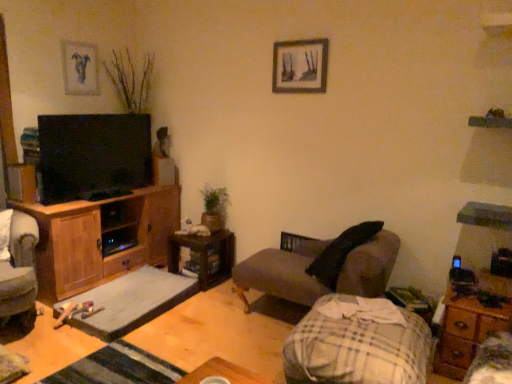
What do you see at coordinates (214, 207) in the screenshot?
I see `green matte plant at center` at bounding box center [214, 207].

The image size is (512, 384). What do you see at coordinates (470, 324) in the screenshot?
I see `wooden nightstand at lower right` at bounding box center [470, 324].

The width and height of the screenshot is (512, 384). Describe the element at coordinates (80, 68) in the screenshot. I see `matte blue painting at upper left, the first picture frame when ordered from back to front` at that location.

What is the approximate width of matte blue painting at upper left, which appears as the 2th picture frame when viewed from the front?

matte blue painting at upper left, which appears as the 2th picture frame when viewed from the front, is 1.08 inches in width.

What do you see at coordinates (204, 255) in the screenshot? I see `brown wooden side table at center` at bounding box center [204, 255].

The height and width of the screenshot is (384, 512). Find the location of `brown wooden side table at center`. brown wooden side table at center is located at coordinates (x=204, y=255).

The image size is (512, 384). I want to click on dark gray fabric couch at center, so 314,277.

Where is `wooden cabinet at left`? The height and width of the screenshot is (384, 512). wooden cabinet at left is located at coordinates (101, 238).

Considering the relative sizes of wooden cabinet at left and brown wooden side table at center in the image provided, is wooden cabinet at left bigger than brown wooden side table at center?

Yes.

Considering the relative positions of wooden cabinet at left and brown wooden side table at center in the image provided, is wooden cabinet at left in front of brown wooden side table at center?

Yes, wooden cabinet at left is closer to the viewer.

From a real-world perspective, is wooden cabinet at left above or below brown wooden side table at center?

From a real-world perspective, wooden cabinet at left is physically above brown wooden side table at center.

From the image's perspective, between gray fabric armchair at left and matte blue painting at upper left, the first picture frame when ordered from back to front, which one is located above?

From the image's view, matte blue painting at upper left, the first picture frame when ordered from back to front, is above.

Considering the sizes of objects gray fabric armchair at left and matte blue painting at upper left, the second picture frame viewed from the right, in the image provided, who is smaller, gray fabric armchair at left or matte blue painting at upper left, the second picture frame viewed from the right,?

matte blue painting at upper left, the second picture frame viewed from the right.

Between gray fabric armchair at left and matte blue painting at upper left, which appears as the 2th picture frame when viewed from the front, which one is positioned behind?

matte blue painting at upper left, which appears as the 2th picture frame when viewed from the front, is behind.

Is point (11, 243) positioned behind point (78, 76)?

No, it is in front of (78, 76).

Is wooden nightstand at lower right at the left side of plaid fabric blanket at lower right?

Incorrect, wooden nightstand at lower right is not on the left side of plaid fabric blanket at lower right.

This screenshot has height=384, width=512. There is a plaid fabric blanket at lower right. What are the coordinates of `nightstand above it (from a real-world perspective)` in the screenshot? It's located at [x=470, y=324].

From the image's perspective, which one is positioned higher, wooden nightstand at lower right or plaid fabric blanket at lower right?

wooden nightstand at lower right is shown above in the image.

Considering their positions, is wooden nightstand at lower right located in front of or behind plaid fabric blanket at lower right?

In the image, wooden nightstand at lower right appears behind plaid fabric blanket at lower right.

Considering the sizes of objects wooden nightstand at lower right and green matte plant at center in the image provided, who is shorter, wooden nightstand at lower right or green matte plant at center?

With less height is wooden nightstand at lower right.

Does wooden nightstand at lower right turn towards green matte plant at center?

No.

Between wooden nightstand at lower right and green matte plant at center, which one appears on the left side from the viewer's perspective?

Positioned to the left is green matte plant at center.

Considering the relative positions of green matte plant at center and gray fabric armchair at left in the image provided, is green matte plant at center to the left of gray fabric armchair at left from the viewer's perspective?

No, green matte plant at center is not to the left of gray fabric armchair at left.

Relative to gray fabric armchair at left, is green matte plant at center in front or behind?

Clearly, green matte plant at center is behind gray fabric armchair at left.

From the image's perspective, which one is positioned higher, green matte plant at center or gray fabric armchair at left?

From the image's view, green matte plant at center is above.

Is plaid fabric blanket at lower right at the left side of wooden cabinet at left?

Incorrect, plaid fabric blanket at lower right is not on the left side of wooden cabinet at left.

Does point (321, 325) lie in front of point (38, 226)?

Yes, it is in front of point (38, 226).

Considering the sizes of objects plaid fabric blanket at lower right and wooden cabinet at left in the image provided, who is taller, plaid fabric blanket at lower right or wooden cabinet at left?

Standing taller between the two is wooden cabinet at left.

From the image's perspective, between plaid fabric blanket at lower right and wooden cabinet at left, which one is located above?

wooden cabinet at left appears higher in the image.

Is brown wooden side table at center not within gray fabric footrest at lower center?

That's correct, brown wooden side table at center is outside of gray fabric footrest at lower center.

Looking at their sizes, would you say brown wooden side table at center is wider or thinner than gray fabric footrest at lower center?

Considering their sizes, brown wooden side table at center looks slimmer than gray fabric footrest at lower center.

From a real-world perspective, is brown wooden side table at center physically below gray fabric footrest at lower center?

No, from a real-world perspective, brown wooden side table at center is not beneath gray fabric footrest at lower center.

Is brown wooden side table at center to the left of gray fabric footrest at lower center from the viewer's perspective?

No, brown wooden side table at center is not to the left of gray fabric footrest at lower center.

In the image, there is a brown wooden side table at center. Where is `cabinetry above it (from the image's perspective)`? This screenshot has width=512, height=384. cabinetry above it (from the image's perspective) is located at coordinates (101, 238).

From a real-world perspective, count 1st picture frames upward from the gray fabric armchair at left and point to it. Please provide its 2D coordinates.

[(80, 68)]

From the image, which object appears to be nearer to gray fabric armchair at left, green matte plant at center or wooden nightstand at lower right?

Among the two, green matte plant at center is located nearer to gray fabric armchair at left.

When comparing their distances from wooden nightstand at lower right, does plaid fabric blanket at lower right or brown wooden side table at center seem further?

Among the two, brown wooden side table at center is located further to wooden nightstand at lower right.

Looking at the image, which one is located closer to dark gray fabric couch at center, green matte plant at center or wooden picture frame at upper center, the second picture frame in the left-to-right sequence?

green matte plant at center is positioned closer to the anchor dark gray fabric couch at center.

Considering their positions, is wooden cabinet at left positioned closer to brown wooden side table at center than gray fabric armchair at left?

Based on the image, wooden cabinet at left appears to be nearer to brown wooden side table at center.

Which object lies nearer to the anchor point gray fabric footrest at lower center, dark gray fabric couch at center or plaid fabric blanket at lower right?

The object closer to gray fabric footrest at lower center is dark gray fabric couch at center.

Looking at the image, which one is located closer to plaid fabric blanket at lower right, matte blue painting at upper left, which appears as the 2th picture frame when viewed from the front, or wooden cabinet at left?

wooden cabinet at left is positioned closer to the anchor plaid fabric blanket at lower right.

Which object lies nearer to the anchor point wooden nightstand at lower right, matte blue painting at upper left, the second picture frame viewed from the right, or brown wooden side table at center?

brown wooden side table at center is positioned closer to the anchor wooden nightstand at lower right.

Estimate the real-world distances between objects in this image. Which object is closer to green matte plant at center, gray fabric footrest at lower center or wooden nightstand at lower right?

gray fabric footrest at lower center lies closer to green matte plant at center than the other object.

The image size is (512, 384). I want to click on side table between wooden picture frame at upper center, the second picture frame in the left-to-right sequence, and dark gray fabric couch at center in the up-down direction, so [x=204, y=255].

Identify the location of picture frame between wooden cabinet at left and dark gray fabric couch at center. The width and height of the screenshot is (512, 384). (300, 66).

Where is `footrest between matte blue painting at upper left, which is the first picture frame from left to right, and wooden nightstand at lower right from left to right`? The image size is (512, 384). footrest between matte blue painting at upper left, which is the first picture frame from left to right, and wooden nightstand at lower right from left to right is located at coordinates (130, 301).

Find the location of a particular element. This screenshot has height=384, width=512. flat between brown wooden side table at center and wooden nightstand at lower right is located at coordinates (357, 344).